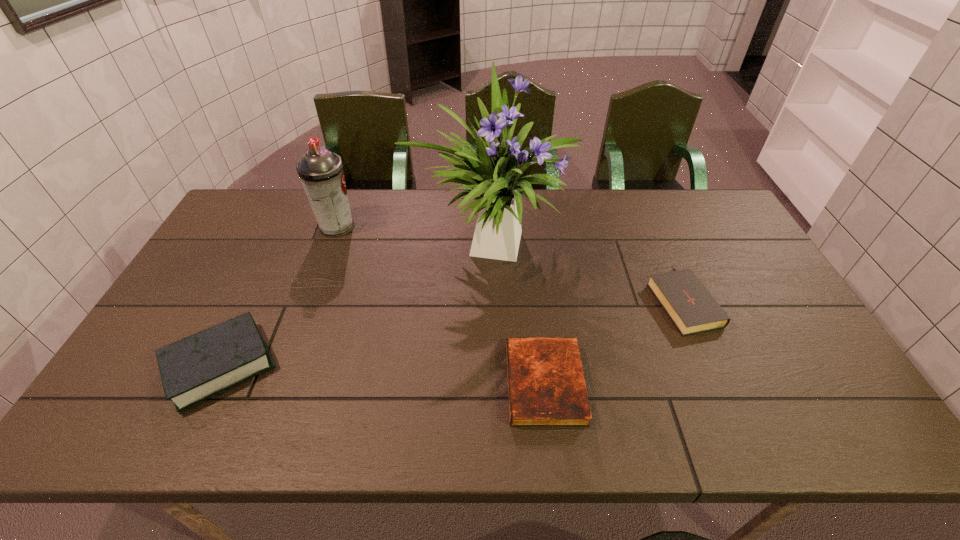
The height and width of the screenshot is (540, 960). In order to click on vacant space situated on the spine side of the second Bible from right to left in this screenshot , I will do `click(449, 383)`.

Where is `vacant space situated 0.140m on the spine side of the second Bible from right to left`? vacant space situated 0.140m on the spine side of the second Bible from right to left is located at coordinates (449, 383).

You are a GUI agent. You are given a task and a screenshot of the screen. Output one action in this format:
    pyautogui.click(x=<x>, y=<y>)
    Task: Click on the vacant region located 0.210m on the spine side of the second Bible from right to left
    The width and height of the screenshot is (960, 540).
    Given the screenshot: What is the action you would take?
    pyautogui.click(x=420, y=383)

You are a GUI agent. You are given a task and a screenshot of the screen. Output one action in this format:
    pyautogui.click(x=<x>, y=<y>)
    Task: Click on the flower arrangement at the far edge
    The image size is (960, 540).
    Given the screenshot: What is the action you would take?
    pyautogui.click(x=493, y=173)

Identify the location of aerosol can that is positioned at the far edge. (320, 171).

The image size is (960, 540). Find the location of `object at the left edge`. object at the left edge is located at coordinates (198, 367).

Find the location of a particular element. object present at the near left corner is located at coordinates (198, 367).

Where is `free region at the far edge of the desktop`? This screenshot has height=540, width=960. free region at the far edge of the desktop is located at coordinates (560, 198).

You are a GUI agent. You are given a task and a screenshot of the screen. Output one action in this format:
    pyautogui.click(x=<x>, y=<y>)
    Task: Click on the free location at the near edge
    
    Given the screenshot: What is the action you would take?
    pyautogui.click(x=732, y=408)

In the image, there is a desktop. Where is `vacant space at the right edge`? vacant space at the right edge is located at coordinates (747, 310).